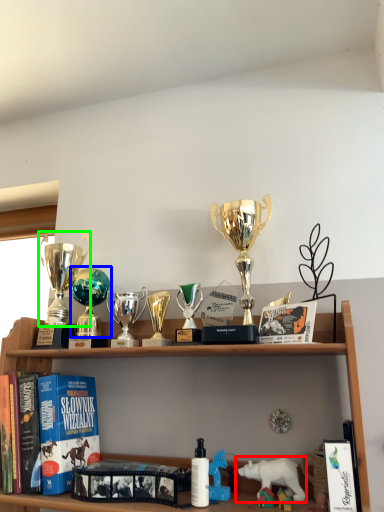
Question: Which object is the farthest from animal (highlighted by a red box)? Choose among these: toy (highlighted by a blue box) or trophy (highlighted by a green box).

Choices:
 (A) toy
 (B) trophy

Answer: (B)